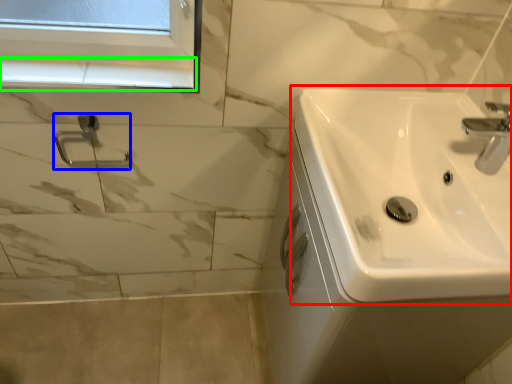
Question: Based on their relative distances, which object is farther from sink (highlighted by a red box)? Choose from shower (highlighted by a blue box) and window sill (highlighted by a green box).

Choices:
 (A) shower
 (B) window sill

Answer: (A)